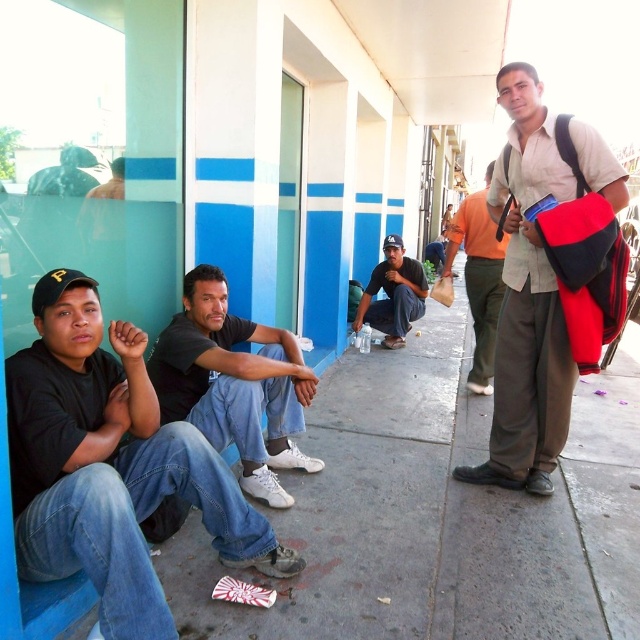
Between orange cotton shirt at right and matte black cap at center, which one has less height?

Standing shorter between the two is matte black cap at center.

Which is behind, point (500, 269) or point (388, 273)?

Positioned behind is point (388, 273).

This screenshot has height=640, width=640. Find the location of `orange cotton shirt at right`. orange cotton shirt at right is located at coordinates (477, 276).

In the scene shown: Is light beige shirt at center bigger than dark gray cotton shirt at center?

Yes, light beige shirt at center is bigger than dark gray cotton shirt at center.

Does light beige shirt at center appear under dark gray cotton shirt at center?

Incorrect, light beige shirt at center is not positioned below dark gray cotton shirt at center.

Is point (508, 307) positioned after point (198, 342)?

Yes.

At what (x,y) coordinates should I click in order to perform the action: click on light beige shirt at center. Please return your answer as a coordinate pair (x, y). Looking at the image, I should click on (528, 304).

Does black matte shirt at left come in front of light beige shirt at center?

That is True.

Is black matte shirt at left shorter than light beige shirt at center?

Yes.

Is point (58, 305) behind point (520, 435)?

That is False.

Where is `black matte shirt at left`? Image resolution: width=640 pixels, height=640 pixels. black matte shirt at left is located at coordinates (109, 465).